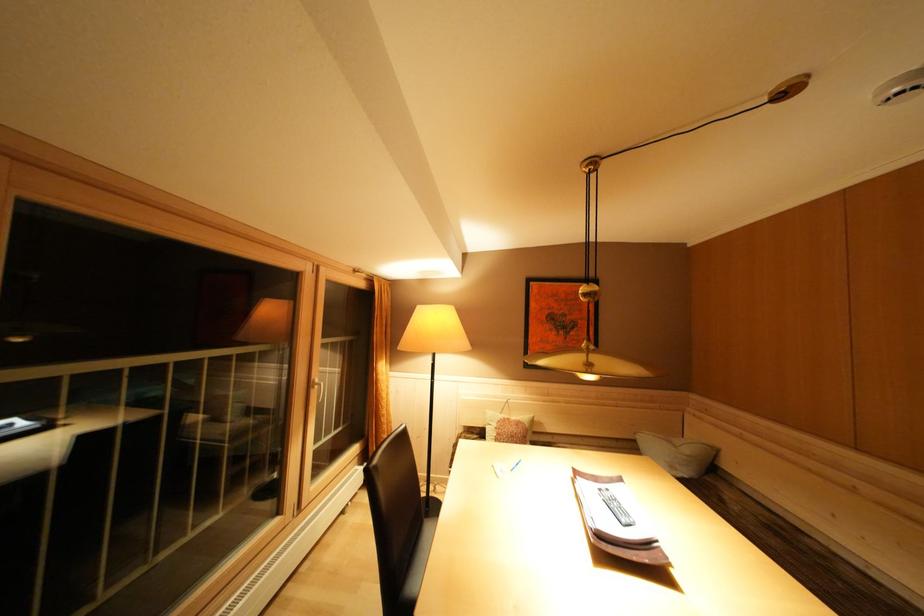
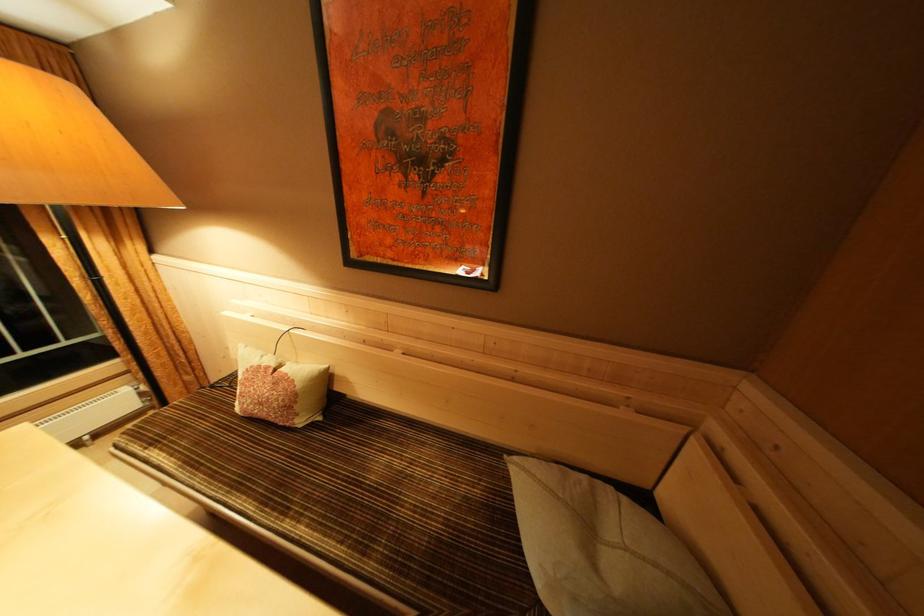
Which direction would the cameraman need to move to produce the second image?

The cameraman moved toward right, forward.